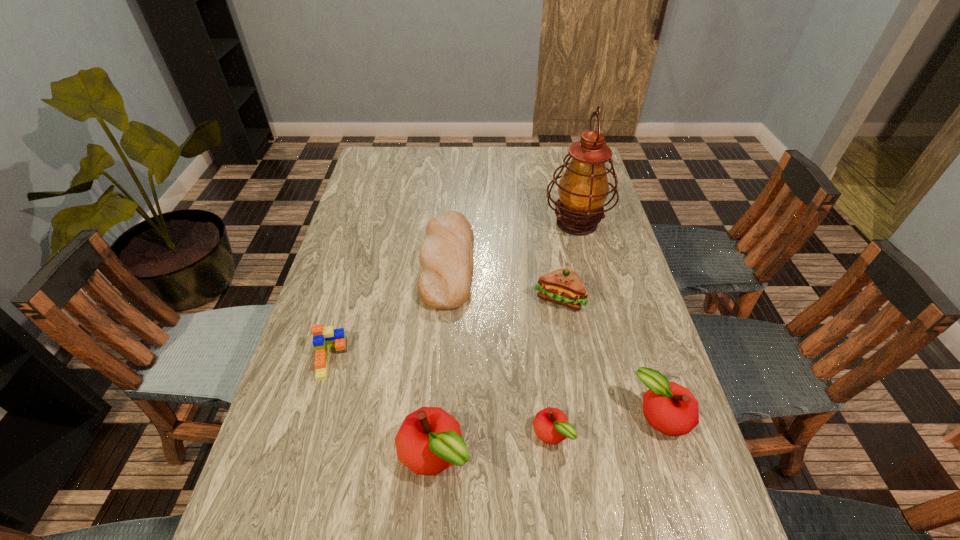
You are a GUI agent. You are given a task and a screenshot of the screen. Output one action in this format:
    pyautogui.click(x=<x>, y=<y>)
    Task: Click on the leftmost apple
    Image resolution: width=960 pixels, height=540 pixels.
    Given the screenshot: What is the action you would take?
    pyautogui.click(x=429, y=440)

Image resolution: width=960 pixels, height=540 pixels. I want to click on the shortest apple, so pos(551,425).

Identify the location of the rightmost apple. (670, 408).

Locate an element on the screen. The width and height of the screenshot is (960, 540). the tallest object is located at coordinates point(583,188).

This screenshot has width=960, height=540. Identify the location of sandwich. (563, 286).

You are a GUI agent. You are given a task and a screenshot of the screen. Output one action in this format:
    pyautogui.click(x=<x>, y=<y>)
    Task: Click on the leftmost object
    
    Given the screenshot: What is the action you would take?
    pyautogui.click(x=323, y=337)

Image resolution: width=960 pixels, height=540 pixels. In order to click on Lego in this screenshot , I will do `click(323, 337)`.

Locate an element on the screen. The width and height of the screenshot is (960, 540). bread is located at coordinates (446, 255).

This screenshot has width=960, height=540. I want to click on vacant point located on the right of the leftmost apple, so click(584, 453).

Locate an element on the screen. vacant space located on the left of the second apple from right to left is located at coordinates (395, 434).